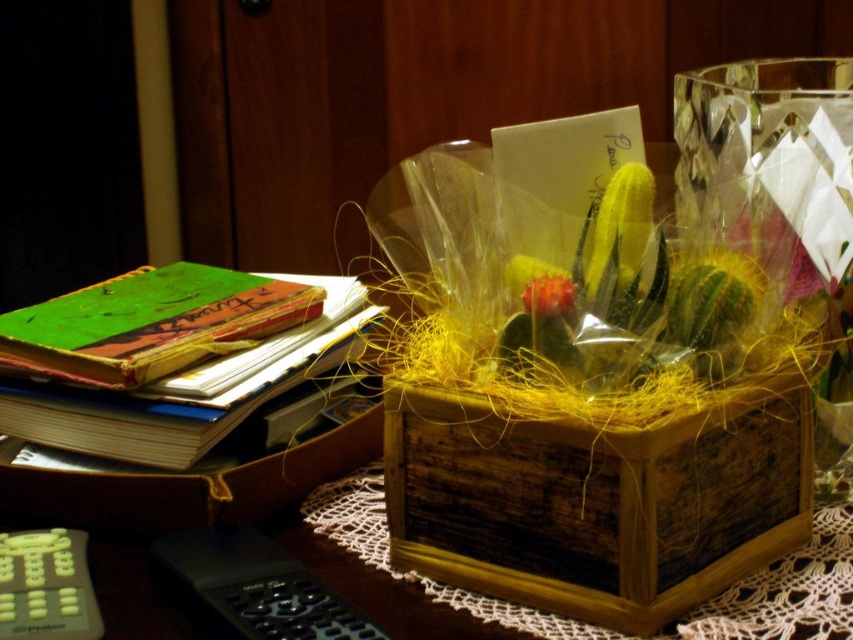
Question: Can you confirm if transparent glass vase at center is positioned below fluffy orange flower at center?

Choices:
 (A) no
 (B) yes

Answer: (A)

Question: Which of the following is the closest to the observer?

Choices:
 (A) (790, 84)
 (B) (624, 262)
 (C) (556, 316)
 (D) (608, 609)

Answer: (D)

Question: Which object appears closest to the camera in this image?

Choices:
 (A) fluffy orange flower at center
 (B) green matte cactus at center
 (C) green matte book at left
 (D) wooden box at center

Answer: (D)

Question: Does transparent glass vase at center have a smaller size compared to green matte cactus at center?

Choices:
 (A) yes
 (B) no

Answer: (B)

Question: Among these points, which one is farthest from the camera?

Choices:
 (A) (93, 420)
 (B) (561, 280)
 (C) (694, 424)

Answer: (A)

Question: Does wooden box at center appear under fluffy orange flower at center?

Choices:
 (A) yes
 (B) no

Answer: (A)